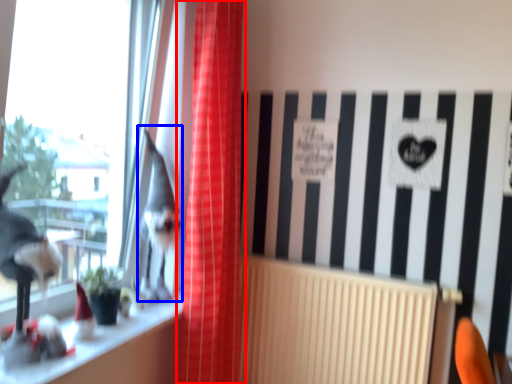
Question: Which object is closer to the camera taking this photo, curtain (highlighted by a red box) or animal (highlighted by a blue box)?

Choices:
 (A) curtain
 (B) animal

Answer: (A)